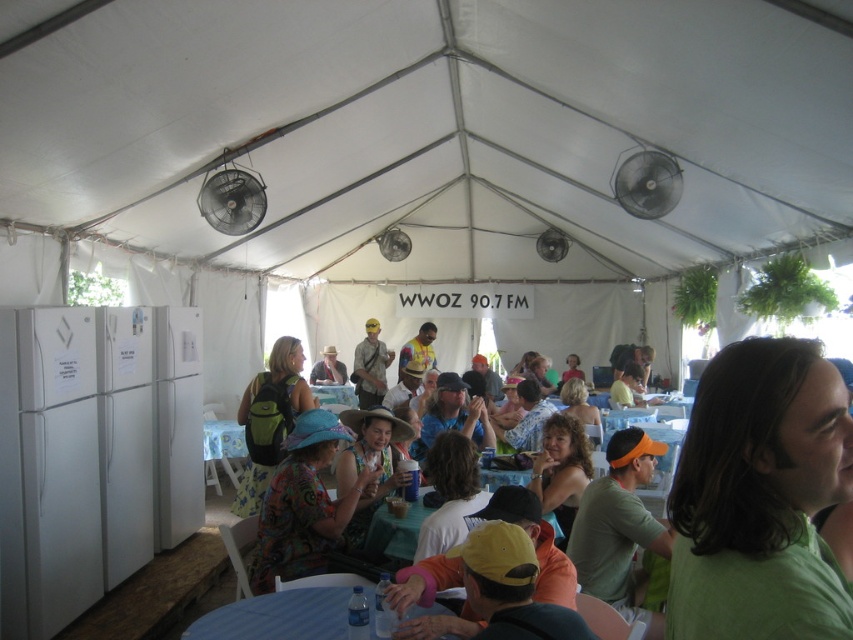
Between point (265, 38) and point (758, 348), which one is positioned in front?

Point (758, 348)

Is white fabric canopy at upper center to the right of green matte shirt at center from the viewer's perspective?

In fact, white fabric canopy at upper center is to the left of green matte shirt at center.

Which is behind, point (206, 172) or point (699, 417)?

The point (206, 172) is more distant.

The image size is (853, 640). Identify the location of white fabric canopy at upper center. (430, 129).

Is white fabric canopy at upper center closer to camera compared to blue fabric table at lower center?

No, it is not.

Does white fabric canopy at upper center have a smaller size compared to blue fabric table at lower center?

No.

Image resolution: width=853 pixels, height=640 pixels. What do you see at coordinates (430, 129) in the screenshot? I see `white fabric canopy at upper center` at bounding box center [430, 129].

I want to click on white fabric canopy at upper center, so click(x=430, y=129).

Can you confirm if white fabric canopy at upper center is thinner than printed fabric dress at center?

No, white fabric canopy at upper center is not thinner than printed fabric dress at center.

Can you confirm if white fabric canopy at upper center is smaller than printed fabric dress at center?

Actually, white fabric canopy at upper center might be larger than printed fabric dress at center.

Is point (134, 60) less distant than point (306, 547)?

No, (134, 60) is further to viewer.

Locate an element on the screen. white fabric canopy at upper center is located at coordinates (430, 129).